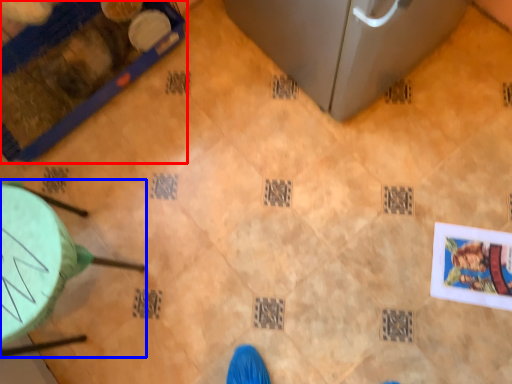
Question: Which point is further to the camera, furniture (highlighted by a red box) or furniture (highlighted by a blue box)?

Choices:
 (A) furniture
 (B) furniture

Answer: (A)